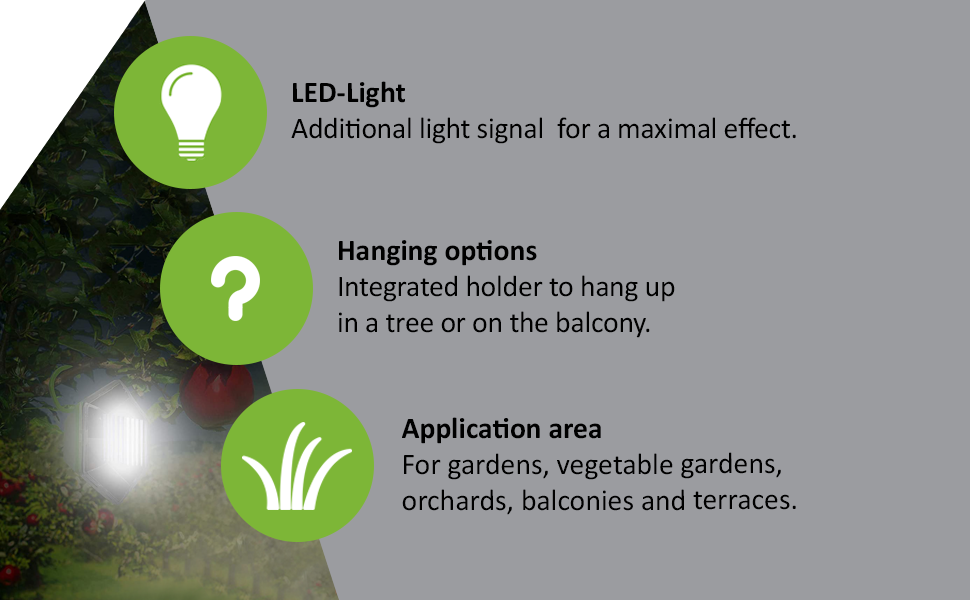
Where is `led light heading`? led light heading is located at coordinates (335, 95).